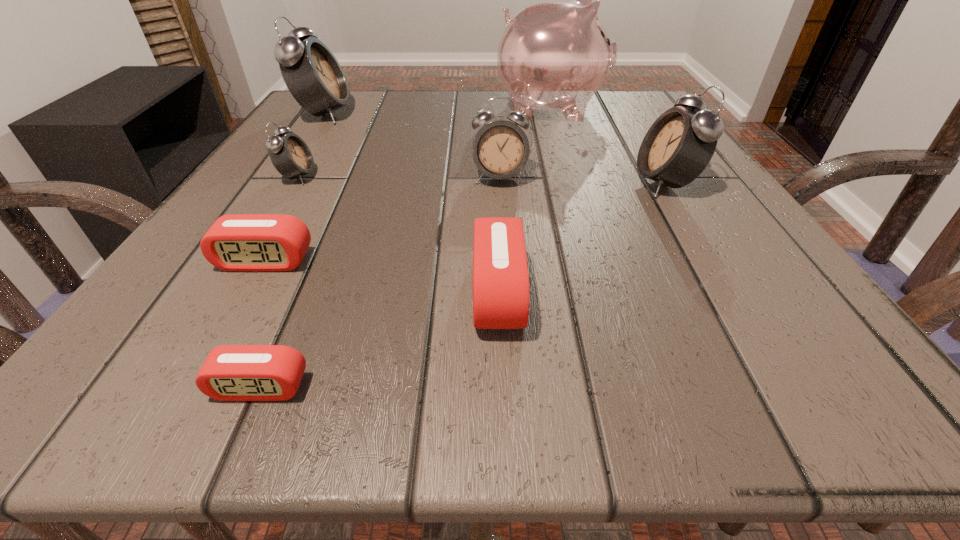
You are a GUI agent. You are given a task and a screenshot of the screen. Output one action in this format:
    pyautogui.click(x=<x>, y=<y>)
    Task: Click on the object that is positioned at the far left corner
    This screenshot has width=960, height=540.
    Given the screenshot: What is the action you would take?
    pyautogui.click(x=314, y=77)

This screenshot has width=960, height=540. I want to click on object that is at the near left corner, so click(230, 372).

The width and height of the screenshot is (960, 540). What are the coordinates of `object positioned at the far right corner` in the screenshot? It's located at (554, 56).

The image size is (960, 540). Find the location of `free space at the far edge`. free space at the far edge is located at coordinates tap(445, 108).

Where is `free region at the near edge of the desktop`? This screenshot has width=960, height=540. free region at the near edge of the desktop is located at coordinates (617, 367).

At what (x,y) coordinates should I click in order to perform the action: click on blank area at the left edge. Please return your answer as a coordinate pair (x, y). Looking at the image, I should click on (235, 198).

You are a GUI agent. You are given a task and a screenshot of the screen. Output one action in this format:
    pyautogui.click(x=<x>, y=<y>)
    Task: Click on the free spot at the right edge of the desktop
    The height and width of the screenshot is (540, 960).
    Given the screenshot: What is the action you would take?
    pyautogui.click(x=761, y=257)

This screenshot has width=960, height=540. In order to click on vacant area at the far left corner of the desktop in this screenshot , I will do `click(300, 127)`.

Locate an element on the screen. The height and width of the screenshot is (540, 960). vacant point located between the third tallest object and the second shortest object is located at coordinates (465, 222).

At what (x,y) coordinates should I click in order to perform the action: click on free space between the piggy bank and the fourth shortest object. Please return your answer as a coordinate pair (x, y). This screenshot has width=960, height=540. Looking at the image, I should click on (424, 143).